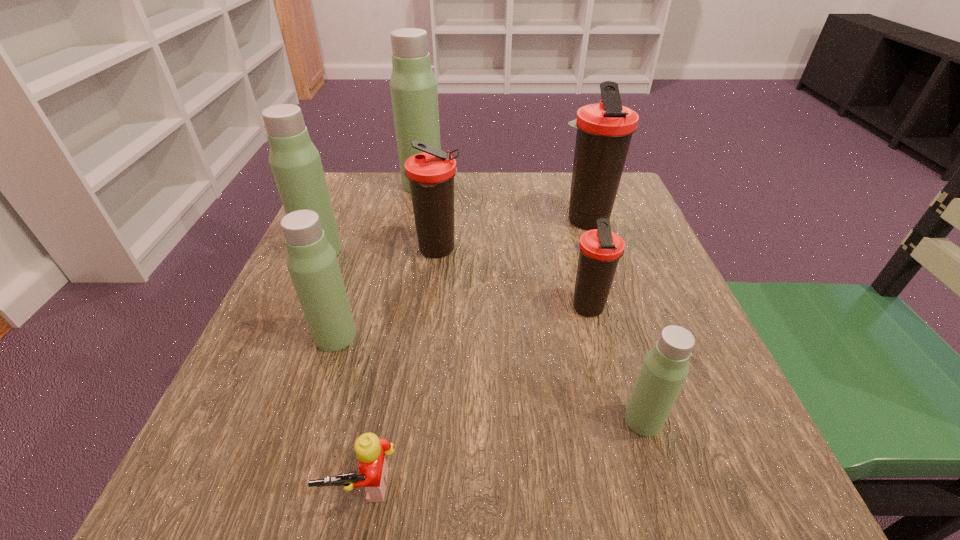
You are a GUI agent. You are given a task and a screenshot of the screen. Output one action in this format:
    pyautogui.click(x=<x>, y=<y>)
    Task: Click on the object present at the near edge
    The image size is (960, 540).
    Given the screenshot: What is the action you would take?
    pyautogui.click(x=370, y=450)

The image size is (960, 540). I want to click on object positioned at the far right corner, so click(x=604, y=130).

Where is `vacant area at the far edge`? Image resolution: width=960 pixels, height=540 pixels. vacant area at the far edge is located at coordinates (559, 179).

Locate an element on the screen. This screenshot has width=960, height=540. vacant space at the near edge of the desktop is located at coordinates click(557, 454).

In the image, there is a desktop. Where is `vacant space at the left edge`? The image size is (960, 540). vacant space at the left edge is located at coordinates (372, 230).

Identify the location of vacant area at the right edge of the desktop. The image size is (960, 540). (678, 306).

In the image, there is a desktop. Identify the location of vacant space at the far left corner. (345, 222).

You are a GUI agent. You are given a task and a screenshot of the screen. Output one action in this format:
    pyautogui.click(x=<x>, y=<y>)
    Task: Click on the vacant space at the far right corner of the desktop
    Image resolution: width=960 pixels, height=540 pixels.
    Given the screenshot: What is the action you would take?
    pyautogui.click(x=565, y=174)

Find the location of a particular element. This screenshot has width=960, height=540. vacant area between the leftmost brown thermos bottle and the biggest brown thermos bottle is located at coordinates (512, 235).

The width and height of the screenshot is (960, 540). What are the coordinates of `empty space that is in between the smallest brown thermos bottle and the rightmost light thermos bottle` in the screenshot? It's located at (614, 364).